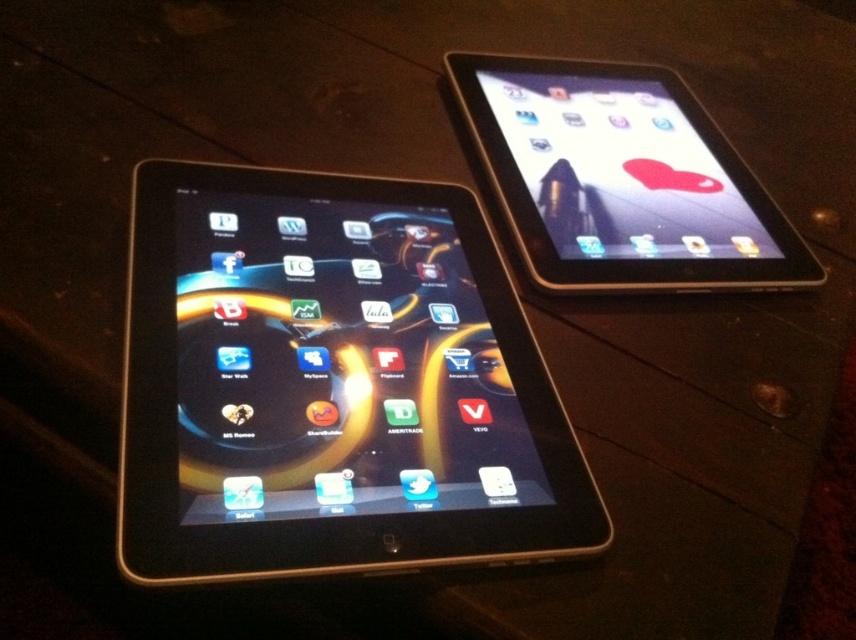
Can you confirm if black glossy tablet at left is thinner than satin black tablet at upper right?

Incorrect, black glossy tablet at left's width is not less than satin black tablet at upper right's.

Is black glossy tablet at left behind satin black tablet at upper right?

No, it is in front of satin black tablet at upper right.

Find the location of `black glossy tablet at left`. black glossy tablet at left is located at coordinates (331, 385).

Locate an element on the screen. black glossy tablet at left is located at coordinates (331, 385).